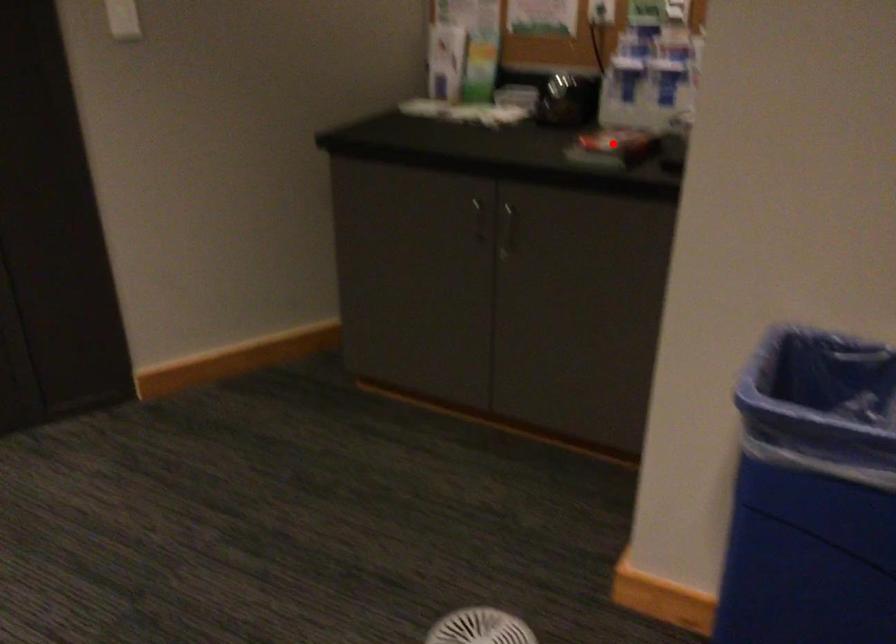
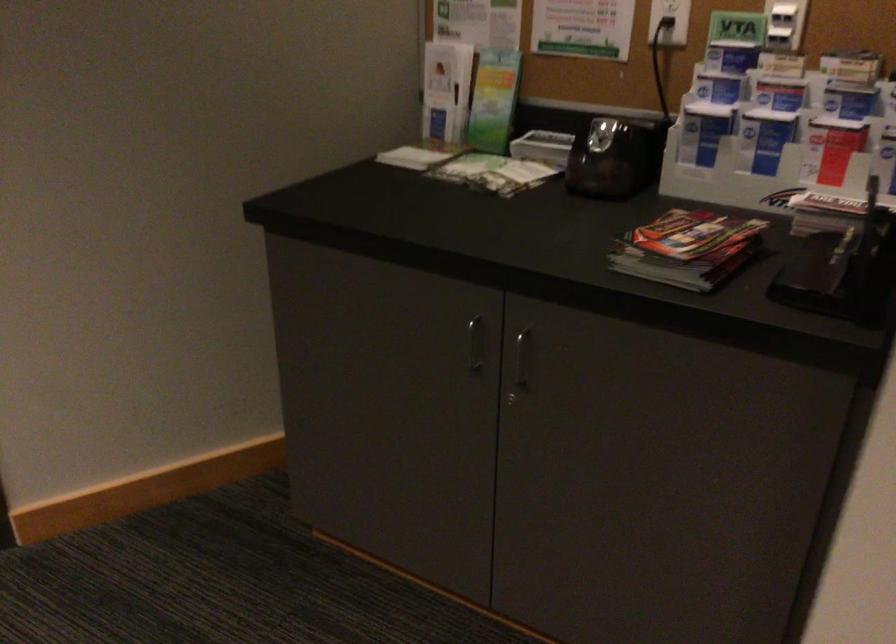
Question: I am providing you with two images of the same scene from different viewpoints. Given a red point in image1, look at the same physical point in image2. Is it:

Choices:
 (A) Closer to the viewpoint
 (B) Farther from the viewpoint

Answer: (A)